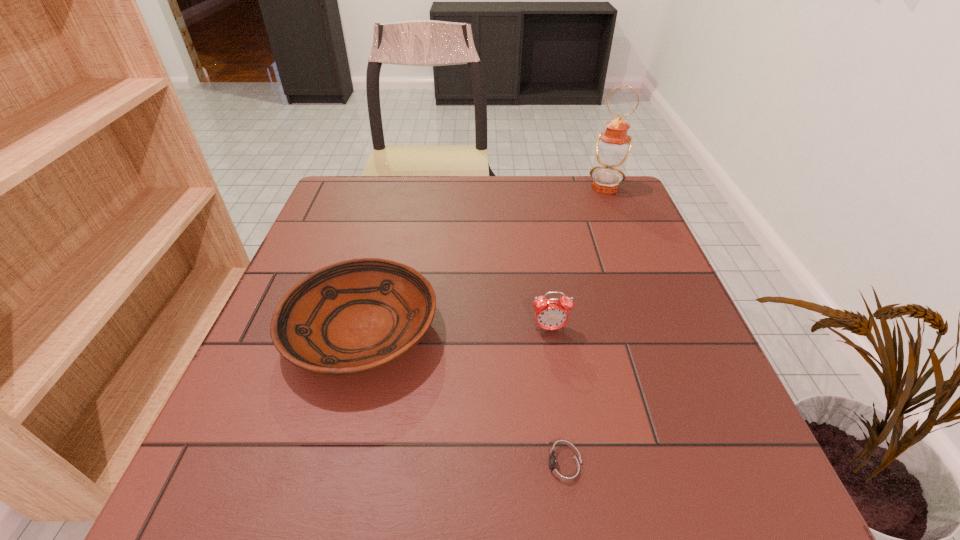
Where is `vacant space that's between the rightmost object and the plate`? Image resolution: width=960 pixels, height=540 pixels. vacant space that's between the rightmost object and the plate is located at coordinates (483, 259).

You are a GUI agent. You are given a task and a screenshot of the screen. Output one action in this format:
    pyautogui.click(x=<x>, y=<y>)
    Task: Click on the empty space between the alarm clock and the third tallest object
    
    Given the screenshot: What is the action you would take?
    pyautogui.click(x=455, y=330)

Locate an element on the screen. vacant space that's between the farthest object and the second tallest object is located at coordinates (577, 259).

Find the location of a particular element. Image resolution: width=960 pixels, height=540 pixels. empty location between the farthest object and the alarm clock is located at coordinates (577, 259).

Where is `vacant space that's between the leftmost object and the alarm clock`? This screenshot has width=960, height=540. vacant space that's between the leftmost object and the alarm clock is located at coordinates (455, 330).

Select which object appears as the closest to the plate. Please provide its 2D coordinates. Your answer should be formatted as a tuple, i.e. [(x, y)], where the tuple contains the x and y coordinates of a point satisfying the conditions above.

[(564, 468)]

Identify which object is the second closest to the third shortest object. Please provide its 2D coordinates. Your answer should be formatted as a tuple, i.e. [(x, y)], where the tuple contains the x and y coordinates of a point satisfying the conditions above.

[(564, 468)]

Where is `free space in the image that satisfies the following two spatial constraints: 1. on the face of the alarm clock; 2. on the face of the watch`? This screenshot has width=960, height=540. free space in the image that satisfies the following two spatial constraints: 1. on the face of the alarm clock; 2. on the face of the watch is located at coordinates (570, 467).

Locate an element on the screen. The width and height of the screenshot is (960, 540). free spot that satisfies the following two spatial constraints: 1. on the face of the alarm clock; 2. on the face of the nearest object is located at coordinates (570, 467).

Where is `blank area in the image that satisfies the following two spatial constraints: 1. on the face of the third shortest object; 2. on the face of the shortest object`? blank area in the image that satisfies the following two spatial constraints: 1. on the face of the third shortest object; 2. on the face of the shortest object is located at coordinates (570, 467).